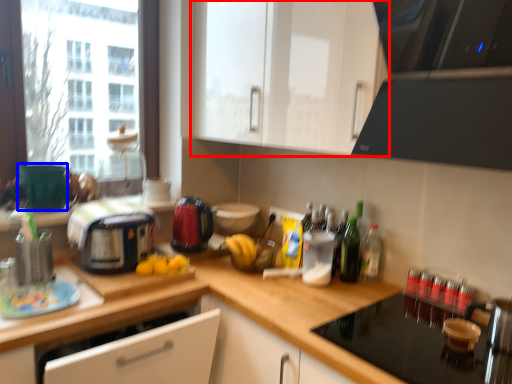
Question: Which of the following is the closest to the observer, cabinetry (highlighted by a red box) or appliance (highlighted by a blue box)?

Choices:
 (A) cabinetry
 (B) appliance

Answer: (A)